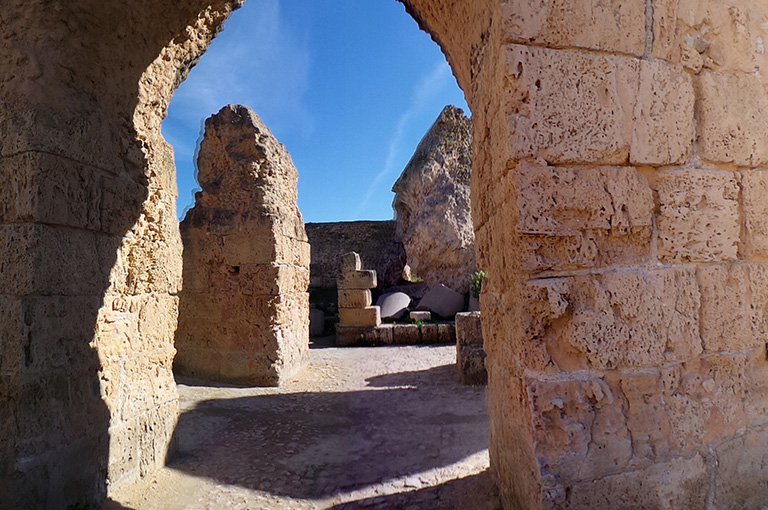
Image resolution: width=768 pixels, height=510 pixels. I want to click on corners, so click(x=461, y=379), click(x=457, y=311), click(x=277, y=382).